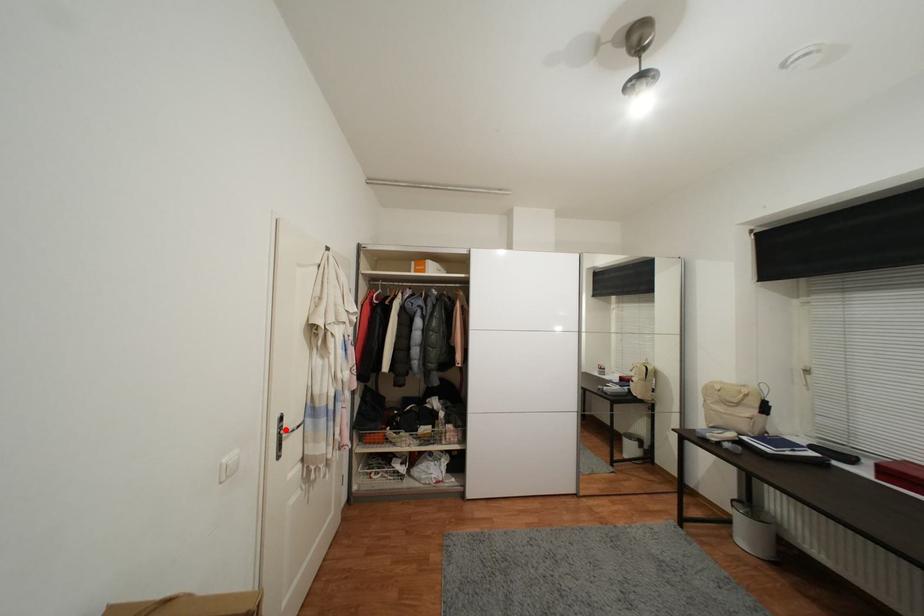
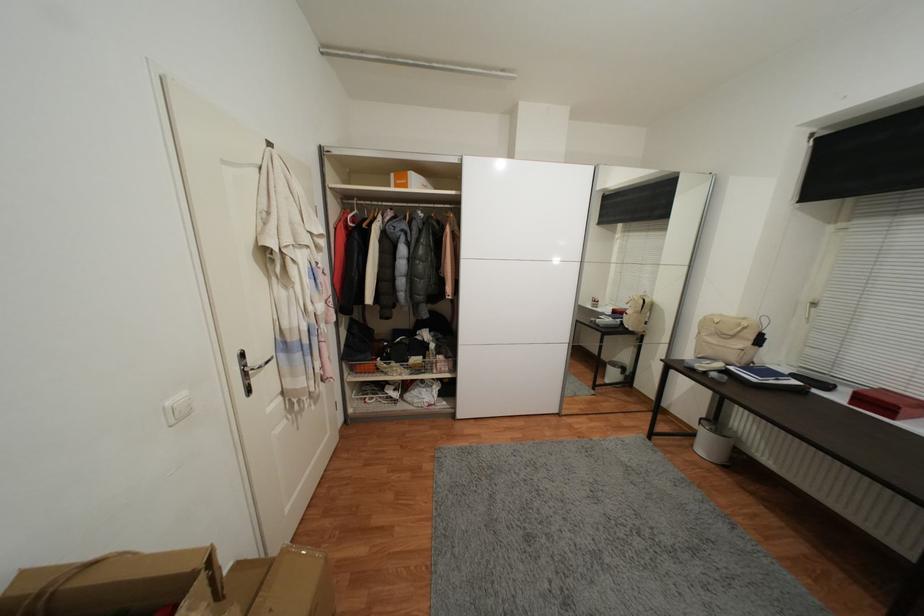
The point at the highlighted location is marked in the first image. Where is the corresponding point in the second image?

(249, 367)